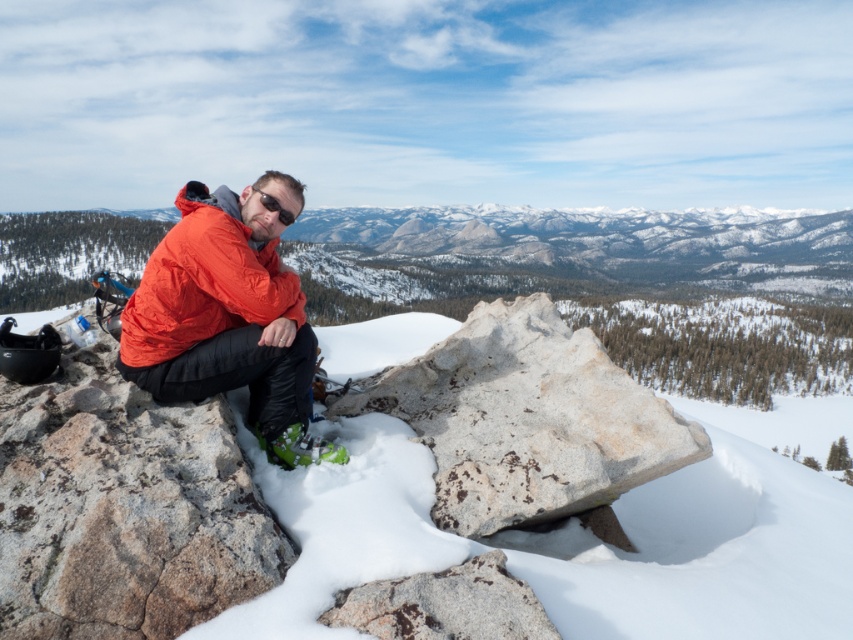
Can you confirm if white powdery snow at center is positioned to the right of matte orange jacket at center?

Yes, white powdery snow at center is to the right of matte orange jacket at center.

Which is more to the right, white powdery snow at center or matte orange jacket at center?

From the viewer's perspective, white powdery snow at center appears more on the right side.

Is point (282, 540) closer to viewer compared to point (279, 180)?

Yes, it is.

At what (x,y) coordinates should I click in order to perform the action: click on white powdery snow at center. Please return your answer as a coordinate pair (x, y). The width and height of the screenshot is (853, 640). Looking at the image, I should click on (194, 516).

Who is more distant from viewer, (471,362) or (263,195)?

The point (471,362) is more distant.

Is granite boulder at center positioned behind black matte sunglasses at center?

No.

At what (x,y) coordinates should I click in order to perform the action: click on granite boulder at center. Please return your answer as a coordinate pair (x, y). This screenshot has height=640, width=853. Looking at the image, I should click on (527, 419).

Where is `granite boulder at center`? The height and width of the screenshot is (640, 853). granite boulder at center is located at coordinates (527, 419).

Who is higher up, granite rock at left or granite boulder at center?

Positioned higher is granite boulder at center.

Between point (131, 387) and point (575, 349), which one is positioned in front?

Point (131, 387) is more forward.

You are a GUI agent. You are given a task and a screenshot of the screen. Output one action in this format:
    pyautogui.click(x=<x>, y=<y>)
    Task: Click on the granite rock at left
    The image size is (853, 640).
    Given the screenshot: What is the action you would take?
    pyautogui.click(x=123, y=508)